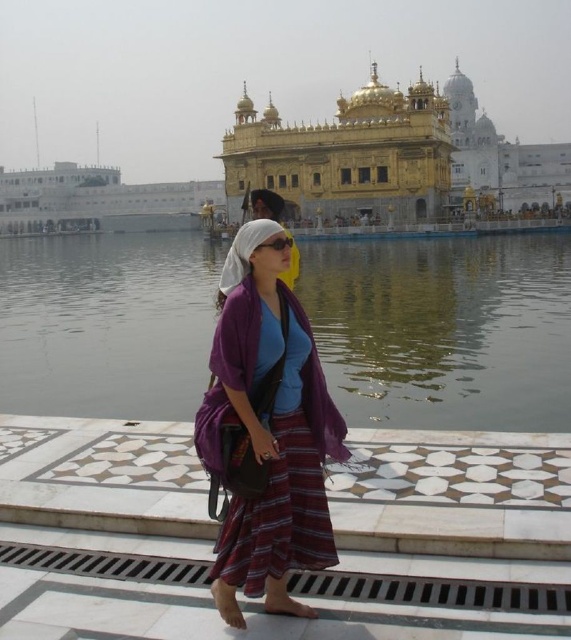
Question: Does transparent water at center appear on the left side of purple fabric scarf at center?

Choices:
 (A) yes
 (B) no

Answer: (A)

Question: Which point appears farthest from the camera in this image?

Choices:
 (A) (63, 403)
 (B) (283, 360)

Answer: (A)

Question: Can you confirm if transparent water at center is thinner than purple fabric scarf at center?

Choices:
 (A) yes
 (B) no

Answer: (B)

Question: Can you confirm if transparent water at center is positioned to the left of purple fabric scarf at center?

Choices:
 (A) yes
 (B) no

Answer: (A)